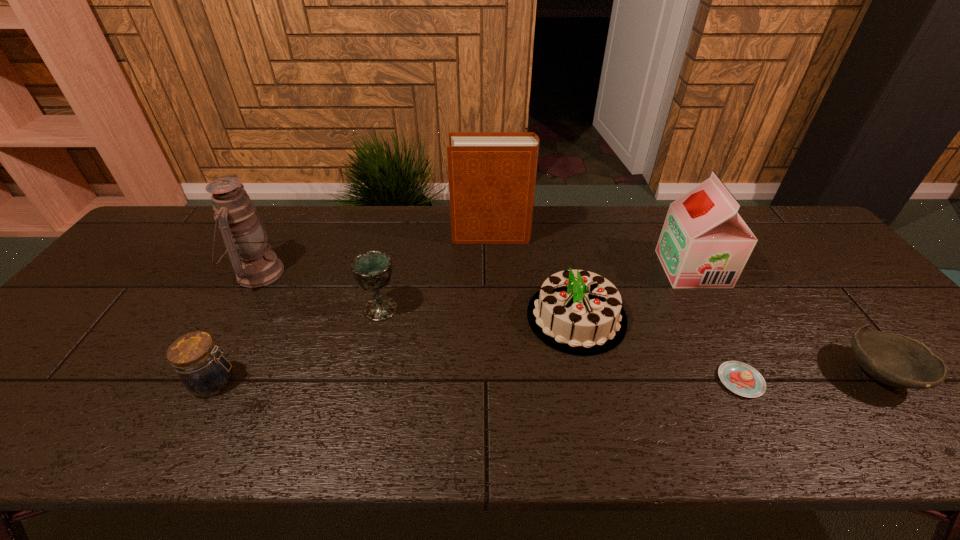
This screenshot has height=540, width=960. Find the location of `the farthest object`. the farthest object is located at coordinates (492, 175).

The image size is (960, 540). I want to click on oil lamp, so click(x=245, y=237).

Locate an element on the screen. Image resolution: width=960 pixels, height=540 pixels. soya milk is located at coordinates (704, 243).

What are the coordinates of `birthday cake` in the screenshot? It's located at (577, 312).

Locate an element on the screen. The height and width of the screenshot is (540, 960). the third object from left to right is located at coordinates (372, 270).

Identify the location of jar. The width and height of the screenshot is (960, 540). (203, 369).

This screenshot has width=960, height=540. In order to click on the second shortest object in this screenshot , I will do tap(896, 360).

You are a GUI agent. You are given a task and a screenshot of the screen. Output one action in this format:
    pyautogui.click(x=<x>, y=<y>)
    Task: Click on the rightmost object
    
    Given the screenshot: What is the action you would take?
    pyautogui.click(x=896, y=360)

The height and width of the screenshot is (540, 960). I want to click on pastry, so (741, 378).

The width and height of the screenshot is (960, 540). What are the coordinates of `vacant space situated 0.080m on the open cover of the farthest object` in the screenshot? It's located at (427, 235).